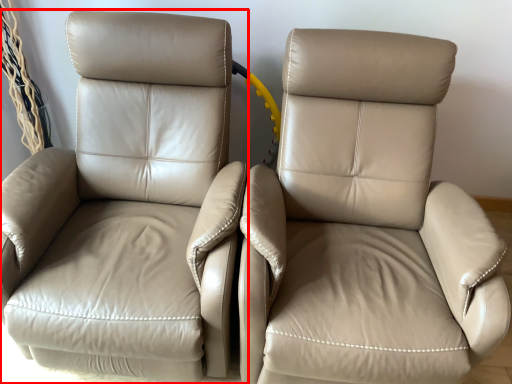
Question: Where is chair (annotated by the red box) located in relation to chair in the image?

Choices:
 (A) right
 (B) left

Answer: (B)